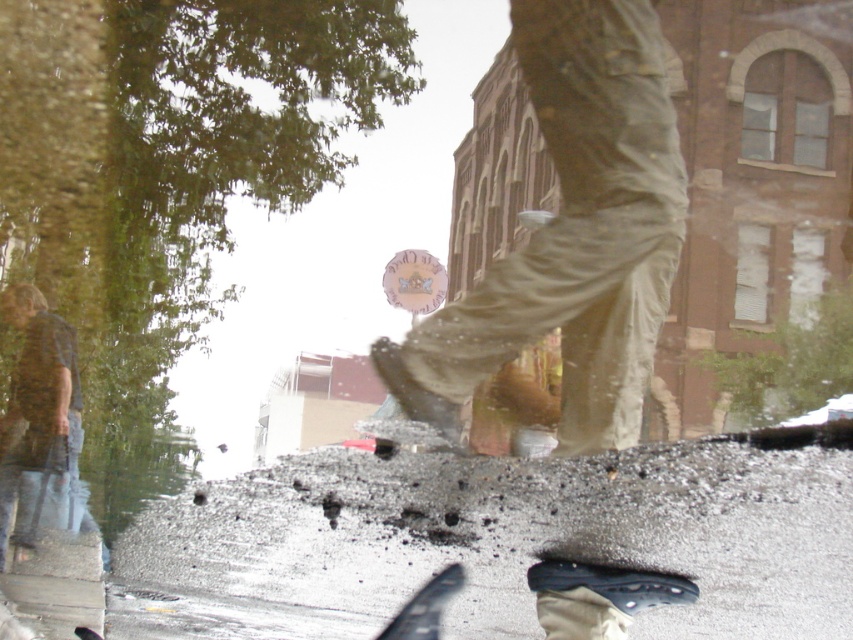
Question: Among these points, which one is farthest from the camera?

Choices:
 (A) (68, 337)
 (B) (648, 237)

Answer: (A)

Question: Which of the following is the farthest from the observer?

Choices:
 (A) (428, 330)
 (B) (526, 611)

Answer: (B)

Question: Does dark gray asphalt at lower center come in front of denim jeans at left?

Choices:
 (A) no
 (B) yes

Answer: (B)

Question: Which is farther from the denim jeans at left?

Choices:
 (A) dark gray asphalt at lower center
 (B) khaki pants at center

Answer: (B)

Question: Is dark gray asphalt at lower center thinner than khaki pants at center?

Choices:
 (A) no
 (B) yes

Answer: (A)

Question: Considering the relative positions of khaki pants at center and denim jeans at left in the image provided, where is khaki pants at center located with respect to denim jeans at left?

Choices:
 (A) above
 (B) below

Answer: (A)